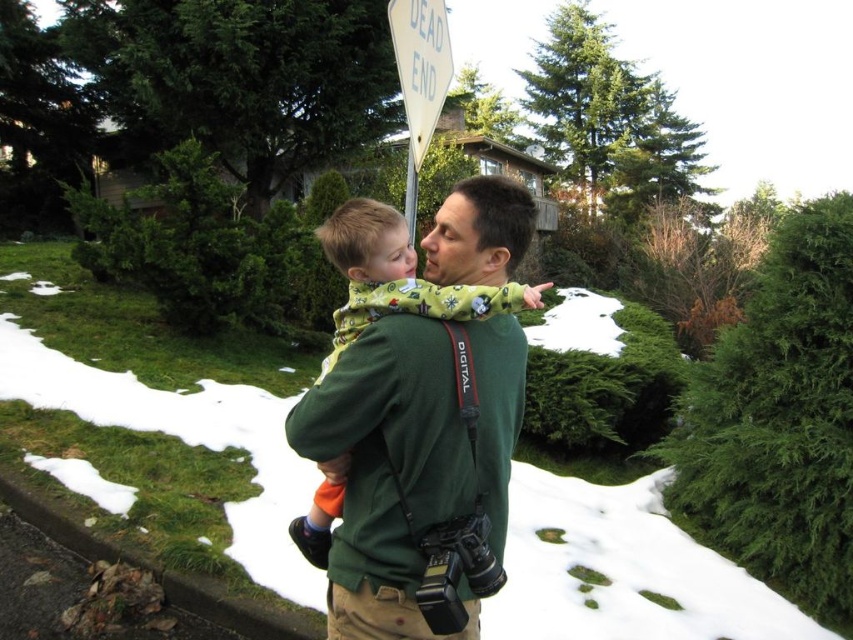
Who is taller, flannel pajamas at center or white paper street sign at upper center?

flannel pajamas at center is taller.

Can you confirm if flannel pajamas at center is taller than white paper street sign at upper center?

Yes.

Is point (413, 291) farther from camera compared to point (408, 58)?

No, it is not.

Image resolution: width=853 pixels, height=640 pixels. What are the coordinates of `flannel pajamas at center` in the screenshot? It's located at (398, 275).